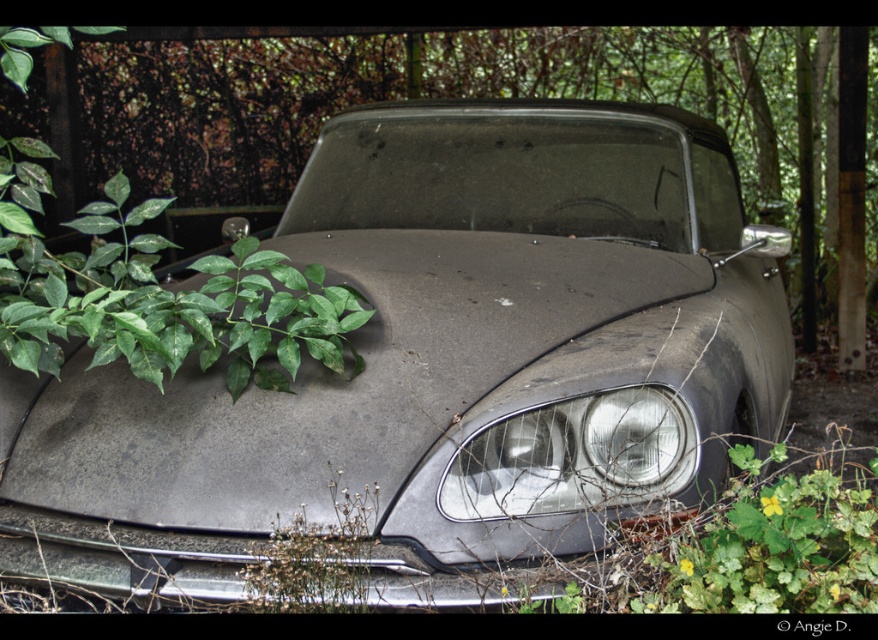
You are a botanist examining the area around the vintage car. You notice the green leafy plant at left and the matte gray headlight at center. Which object takes up more space in the image?

The green leafy plant at left is larger in size than the matte gray headlight at center, so it takes up more space in the image.

Consider the image. You are standing in front of the vintage car and want to take a photo of the green leafy plant at left. Where should you position yourself to capture the plant in the frame?

The green leafy plant at left is located at coordinates (x=423, y=97), so position yourself to the left side of the car to include the plant in your photo frame.

You are a photographer wanting to capture the matte gray car at center and the matte gray headlight at center in a single frame. Since both are at the center, how can you determine which one is closer to the camera?

The matte gray car at center is located above the matte gray headlight at center, so the headlight is closer to the camera because objects lower in the frame are typically nearer.